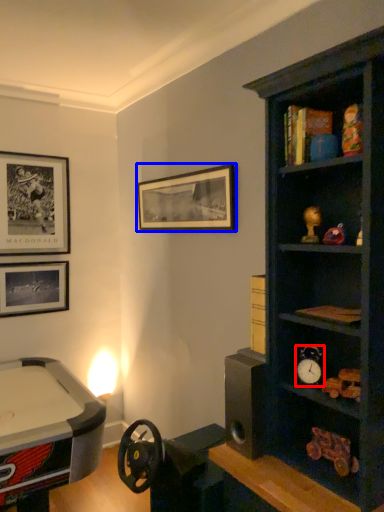
Question: Which object appears closest to the camera in this image, clock (highlighted by a red box) or picture frame (highlighted by a blue box)?

Choices:
 (A) clock
 (B) picture frame

Answer: (A)